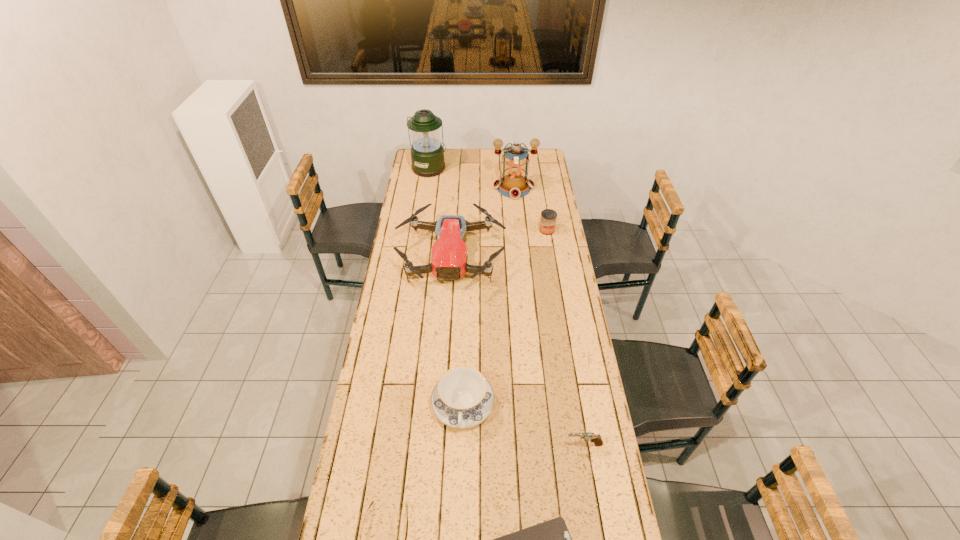
The width and height of the screenshot is (960, 540). Find the location of `object that is the seventh closest to the right lantern`. object that is the seventh closest to the right lantern is located at coordinates (551, 539).

Identify the location of vacant space that satisfies the following two spatial constraints: 1. on the front-facing side of the can; 2. on the right side of the right lantern. (517, 230).